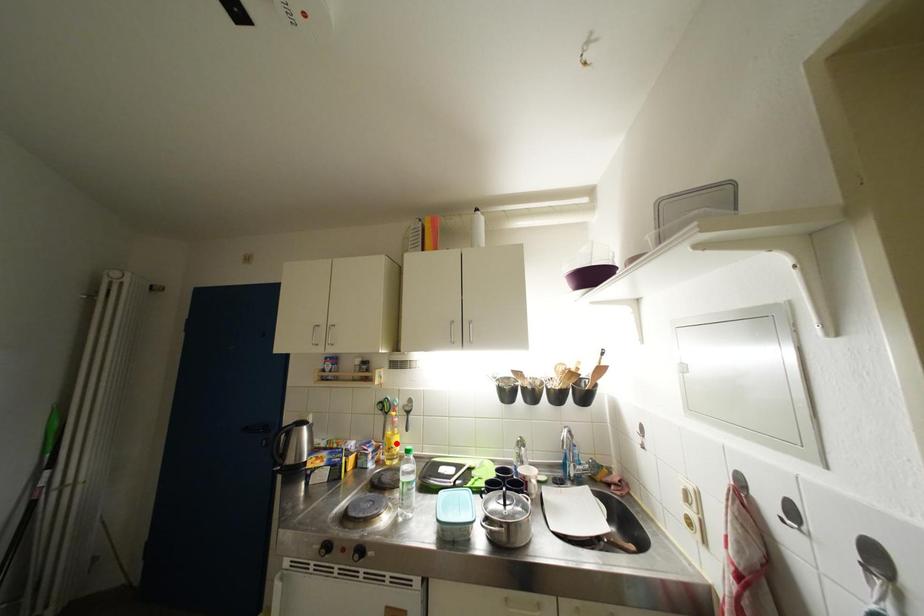
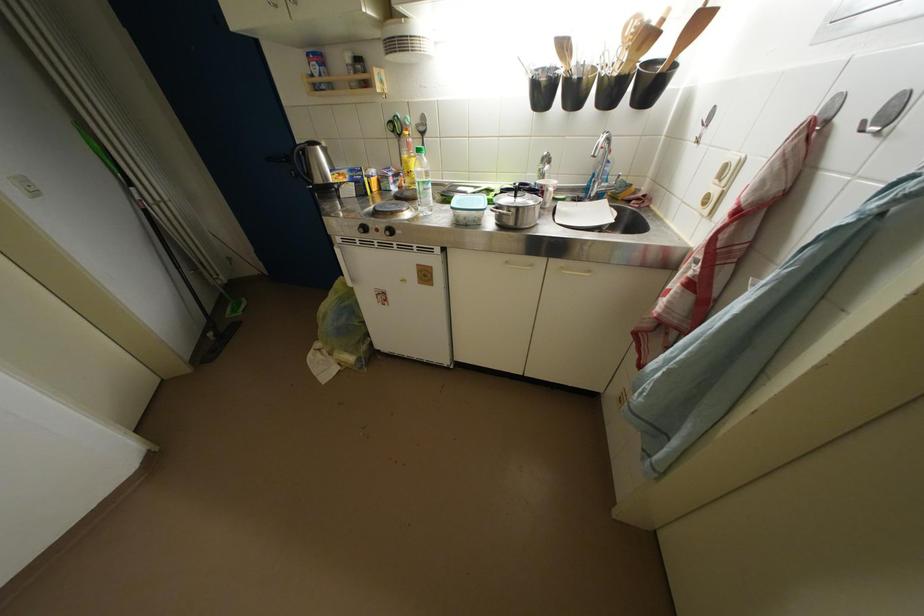
Question: I am providing you with two images of the same scene from different viewpoints. Given a red point in image1, look at the same physical point in image2. Is it:

Choices:
 (A) Closer to the viewpoint
 (B) Farther from the viewpoint

Answer: (A)